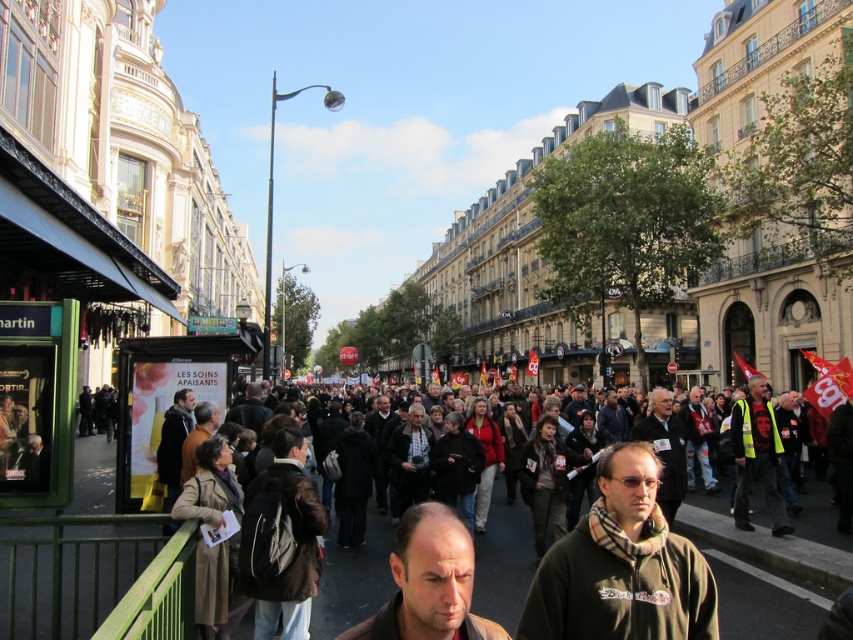
You are a photographer standing at the edge of the crowd. You want to capture both the dark green hoodie at center and the brown leather jacket at center in a single photo. What is the minimum distance you need to move backward to ensure both subjects are in frame?

The dark green hoodie at center and the brown leather jacket at center are 24.62 feet apart. To capture both in a single photo, you need to move back at least 24.62 feet to ensure the entire distance between them fits within the camera frame.

You are a photographer standing at the edge of the crowd in the European city street scene. You want to take a photo that includes both the point at coordinates [573,582] and the point at [370,548]. Which point should you focus on first to ensure both are in sharp focus?

You should focus on point [573,582] first because it is closer to the camera and will ensure the point at [370,548] is also in focus when using a shallow depth of field.